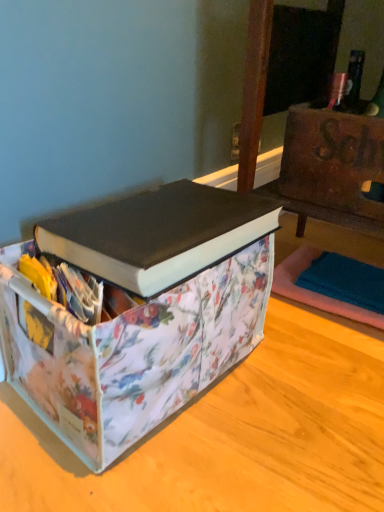
Identify the location of free spot above black matte book at center (from a real-world perspective). This screenshot has width=384, height=512. (173, 214).